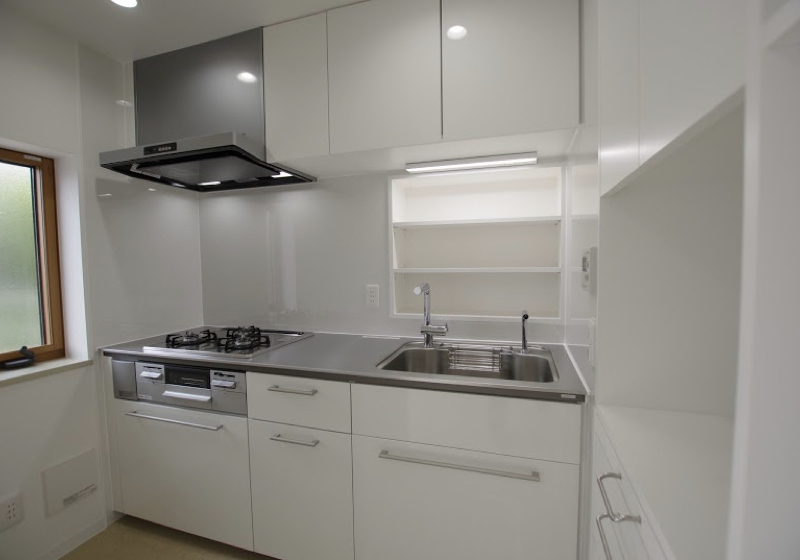
Where is `shelves`? Image resolution: width=800 pixels, height=560 pixels. shelves is located at coordinates pyautogui.click(x=492, y=261).